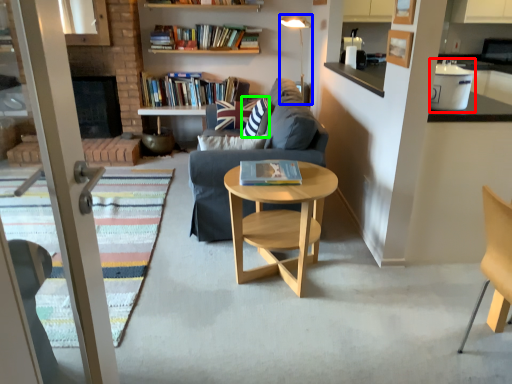
Question: Which object is positioned closest to appliance (highlighted by a red box)? Select from lamp (highlighted by a blue box) and pillow (highlighted by a green box).

Choices:
 (A) lamp
 (B) pillow

Answer: (B)